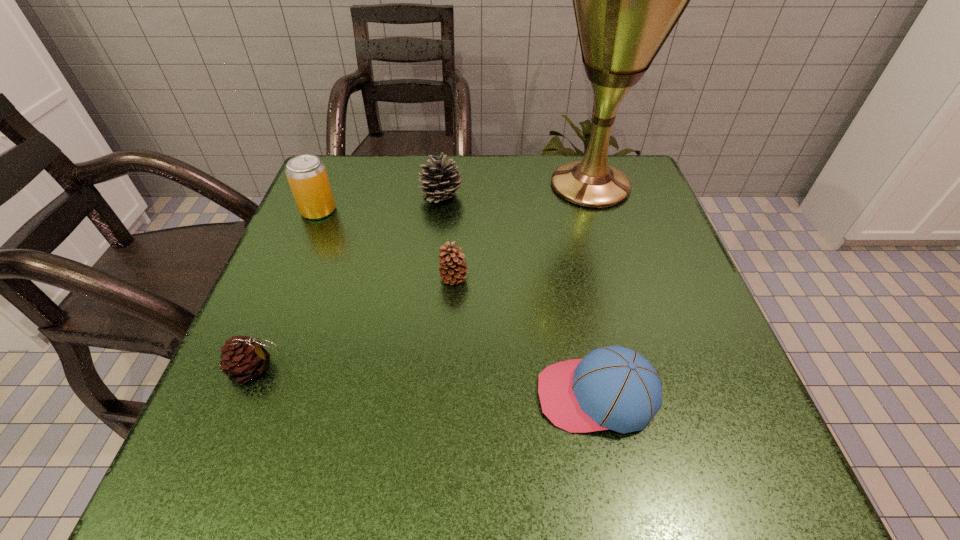
Find the location of a particular element. The image size is (960, 540). blank space that satisfies the following two spatial constraints: 1. on the front side of the third nearest object; 2. with a leaf charm attached to the leftmost pinecone is located at coordinates (449, 368).